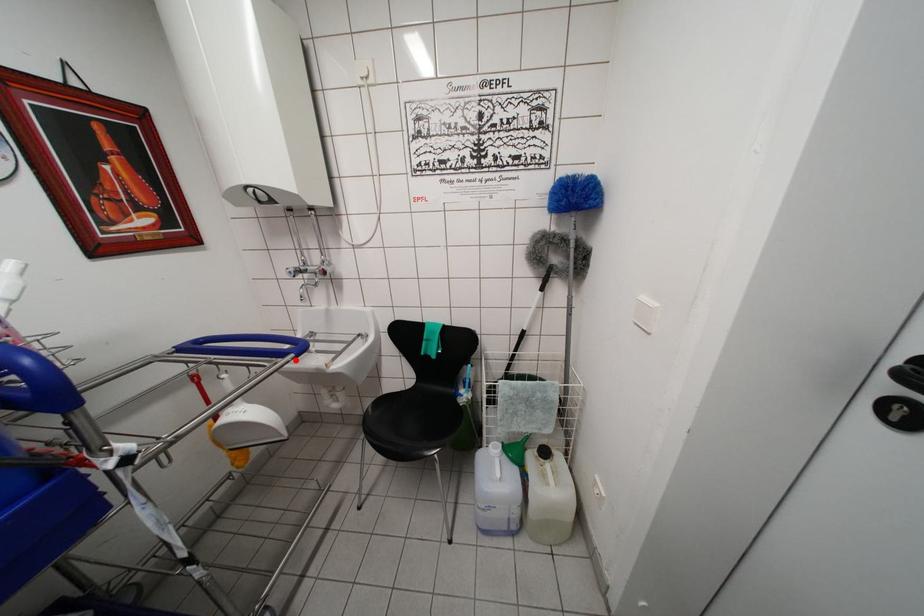
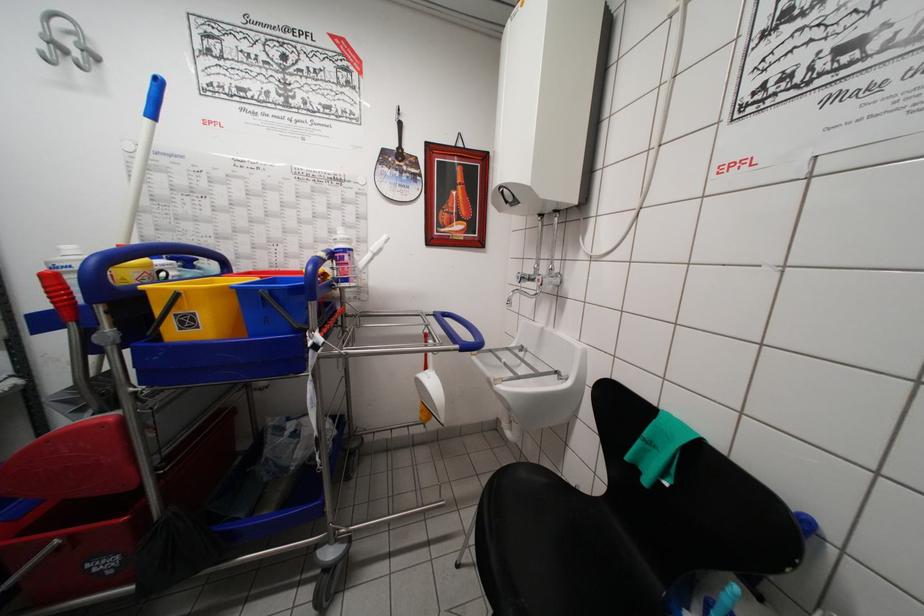
Question: I am providing you with two images of the same scene from different viewpoints. A red point is marked on the first image. Can you still see the location of the red point in image 2?

Choices:
 (A) Yes
 (B) No

Answer: (A)